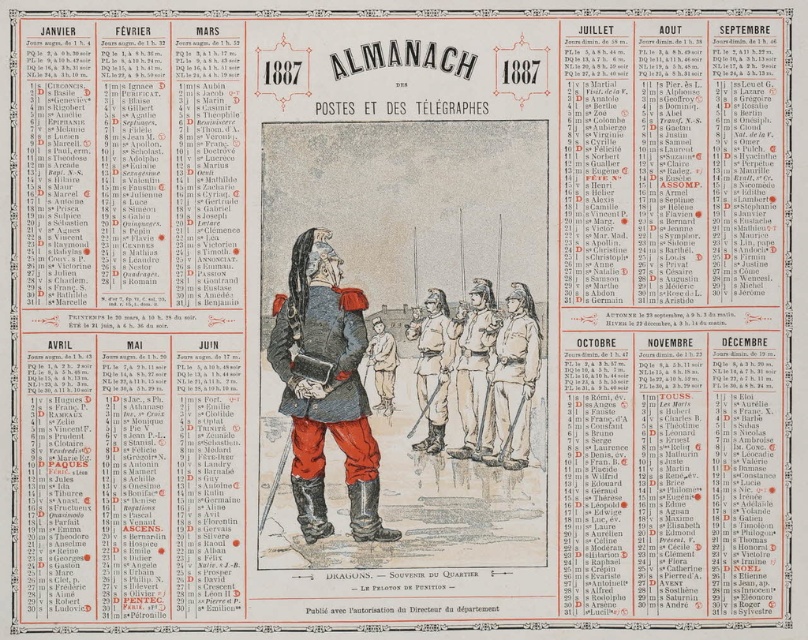
You are examining the central illustration of the vintage almanac. You notice the light brown leather uniform at center and the brown leather boots at center. Which object is positioned lower in the image?

The light brown leather uniform at center is located below brown leather boots at center, so the light brown leather uniform at center is positioned lower in the image.

You are a tailor examining the vintage almanac and notice the light brown leather uniform at center and the brown leather boots at center. Which item is wider?

The light brown leather uniform at center is wider than the brown leather boots at center.

You are a tailor examining the vintage almanac and notice the smooth blue coat at center and brown leather boots at center. Which item appears narrower in the illustration?

The smooth blue coat at center is narrower than the brown leather boots at center because its width is less than that of the boots.